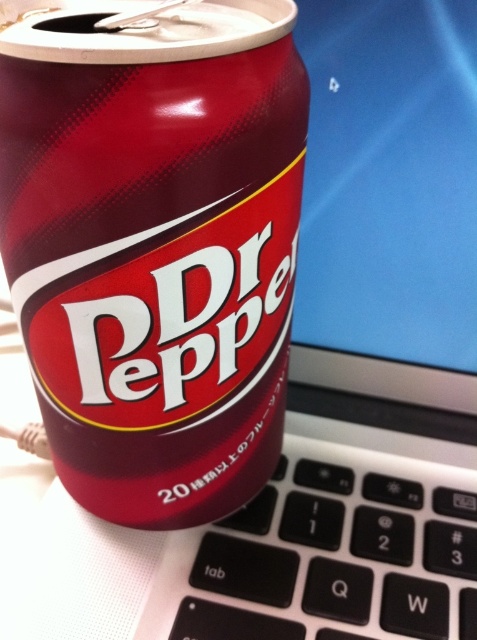
Question: Which point is closer to the camera taking this photo?

Choices:
 (A) (253, 612)
 (B) (298, 104)

Answer: (B)

Question: Where is glossy metallic can at center located in relation to black plastic keyboard at lower center in the image?

Choices:
 (A) right
 (B) left

Answer: (B)

Question: From the image, what is the correct spatial relationship of glossy metallic can at center in relation to black plastic keyboard at lower center?

Choices:
 (A) left
 (B) right

Answer: (A)

Question: Does glossy metallic can at center have a lesser width compared to black plastic keyboard at lower center?

Choices:
 (A) no
 (B) yes

Answer: (B)

Question: Which point is closer to the camera?

Choices:
 (A) (406, 502)
 (B) (99, 6)

Answer: (B)